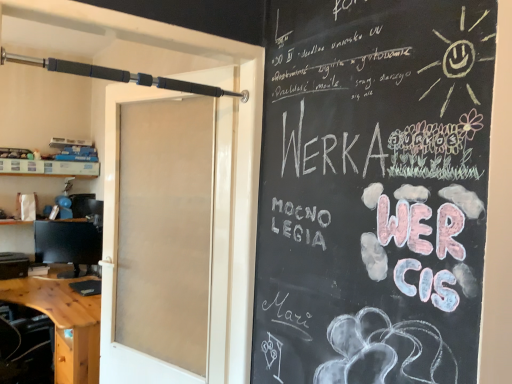
Where is `blank space above wooden desk at lower left (from a real-world perspective)`? The width and height of the screenshot is (512, 384). blank space above wooden desk at lower left (from a real-world perspective) is located at coordinates (57, 294).